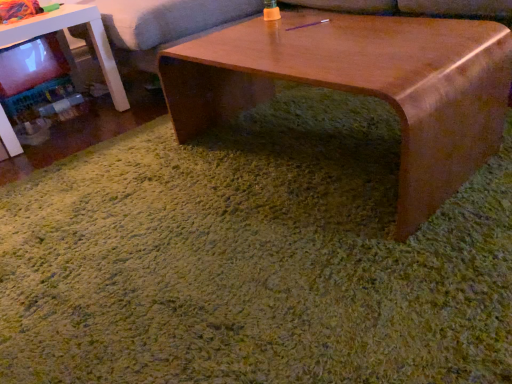
The height and width of the screenshot is (384, 512). Describe the element at coordinates (164, 23) in the screenshot. I see `soft gray couch at upper center` at that location.

What do you see at coordinates (361, 86) in the screenshot? I see `wooden coffee table at center` at bounding box center [361, 86].

At what (x,y) coordinates should I click in order to perform the action: click on white glossy table at left. Please return your answer as a coordinate pair (x, y). Looking at the image, I should click on (67, 27).

Could you tell me if white glossy table at left is turned towards soft gray couch at upper center?

No, white glossy table at left is not facing towards soft gray couch at upper center.

This screenshot has height=384, width=512. In order to click on table on the left side of soft gray couch at upper center in this screenshot , I will do `click(67, 27)`.

Is white glossy table at left situated inside soft gray couch at upper center or outside?

white glossy table at left lies outside soft gray couch at upper center.

Are white glossy table at left and soft gray couch at upper center making contact?

They are not placed beside each other.

From a real-world perspective, between white glossy table at left and wooden coffee table at center, who is vertically higher?

From a 3D spatial view, white glossy table at left is above.

Who is bigger, white glossy table at left or wooden coffee table at center?

With larger size is wooden coffee table at center.

Looking at this image, how different are the orientations of white glossy table at left and wooden coffee table at center in degrees?

There is a 90.4-degree angle between the facing directions of white glossy table at left and wooden coffee table at center.

What's the angular difference between soft gray couch at upper center and white glossy table at left's facing directions?

88.3 degrees separate the facing orientations of soft gray couch at upper center and white glossy table at left.

Is soft gray couch at upper center aimed at white glossy table at left?

Yes.

Between soft gray couch at upper center and white glossy table at left, which one appears on the left side from the viewer's perspective?

white glossy table at left is more to the left.

Can you confirm if soft gray couch at upper center is thinner than white glossy table at left?

No.

Does point (419, 83) appear closer or farther from the camera than point (12, 29)?

Point (419, 83) is positioned closer to the camera compared to point (12, 29).

Does wooden coffee table at center come behind white glossy table at left?

That is False.

Is wooden coffee table at center oriented towards white glossy table at left?

No, wooden coffee table at center is not aimed at white glossy table at left.

Does wooden coffee table at center have a smaller size compared to soft gray couch at upper center?

Correct, wooden coffee table at center occupies less space than soft gray couch at upper center.

Locate an element on the screen. The image size is (512, 384). couch on the left of the wooden coffee table at center is located at coordinates (164, 23).

Can soft gray couch at upper center be found inside wooden coffee table at center?

No.

Can you tell me how much wooden coffee table at center and soft gray couch at upper center differ in facing direction?

The facing directions of wooden coffee table at center and soft gray couch at upper center are 2.04 degrees apart.

Can you confirm if soft gray couch at upper center is bigger than wooden coffee table at center?

Correct, soft gray couch at upper center is larger in size than wooden coffee table at center.

Considering the sizes of objects soft gray couch at upper center and wooden coffee table at center in the image provided, who is shorter, soft gray couch at upper center or wooden coffee table at center?

wooden coffee table at center.

Is soft gray couch at upper center far away from wooden coffee table at center?

They are positioned close to each other.

Is wooden coffee table at center a part of soft gray couch at upper center?

No, wooden coffee table at center is not a part of soft gray couch at upper center.

Where is `couch above the white glossy table at left (from the image's perspective)`? This screenshot has width=512, height=384. couch above the white glossy table at left (from the image's perspective) is located at coordinates (164, 23).

The height and width of the screenshot is (384, 512). In order to click on coffee table lying below the white glossy table at left (from the image's perspective) in this screenshot , I will do `click(361, 86)`.

Estimate the real-world distances between objects in this image. Which object is further from wooden coffee table at center, soft gray couch at upper center or white glossy table at left?

white glossy table at left.

In the scene shown: When comparing their distances from soft gray couch at upper center, does white glossy table at left or wooden coffee table at center seem closer?

white glossy table at left is positioned closer to the anchor soft gray couch at upper center.

Considering their positions, is wooden coffee table at center positioned closer to white glossy table at left than soft gray couch at upper center?

soft gray couch at upper center is closer to white glossy table at left.

From the image, which object appears to be farther from soft gray couch at upper center, wooden coffee table at center or white glossy table at left?

Among the two, wooden coffee table at center is located further to soft gray couch at upper center.

When comparing their distances from wooden coffee table at center, does white glossy table at left or soft gray couch at upper center seem closer?

The object closer to wooden coffee table at center is soft gray couch at upper center.

Considering their positions, is soft gray couch at upper center positioned further to white glossy table at left than wooden coffee table at center?

Among the two, wooden coffee table at center is located further to white glossy table at left.

You are a GUI agent. You are given a task and a screenshot of the screen. Output one action in this format:
    pyautogui.click(x=<x>, y=<y>)
    Task: Click on the couch located between white glossy table at left and wooden coffee table at center in the left-right direction
    The height and width of the screenshot is (384, 512).
    Given the screenshot: What is the action you would take?
    pyautogui.click(x=164, y=23)